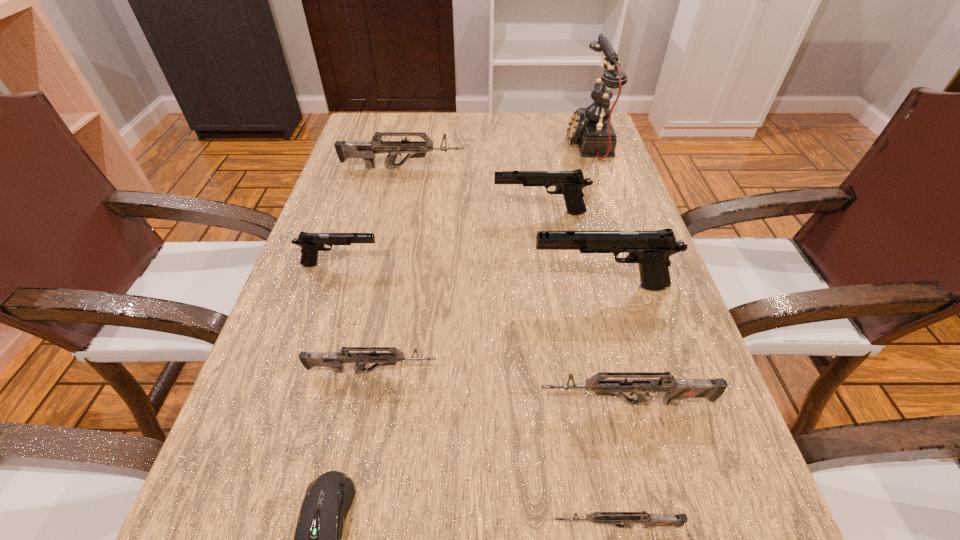
Where is `the second nearest grey gun`? the second nearest grey gun is located at coordinates (676, 389).

Identify the location of the seventh farthest object. The image size is (960, 540). (676, 389).

Where is `the second farthest grey gun`? This screenshot has width=960, height=540. the second farthest grey gun is located at coordinates (335, 360).

Where is `the third shortest object`? The width and height of the screenshot is (960, 540). the third shortest object is located at coordinates (335, 360).

You are a GUI agent. You are given a task and a screenshot of the screen. Output one action in this format:
    pyautogui.click(x=<x>, y=<y>)
    Task: Click on the shortest gun
    This screenshot has height=540, width=960.
    Given the screenshot: What is the action you would take?
    pyautogui.click(x=617, y=519)

Find the location of `the second shortest object`. the second shortest object is located at coordinates (617, 519).

This screenshot has width=960, height=540. I want to click on free location located on the dial of the tallest object, so click(503, 144).

I want to click on free point located on the dial of the tallest object, so click(503, 144).

Locate an element on the screen. free space located on the dial of the tallest object is located at coordinates (468, 144).

In order to click on vacant area situated 0.330m at the aiming end of the fifth farthest object in this screenshot , I will do `click(363, 286)`.